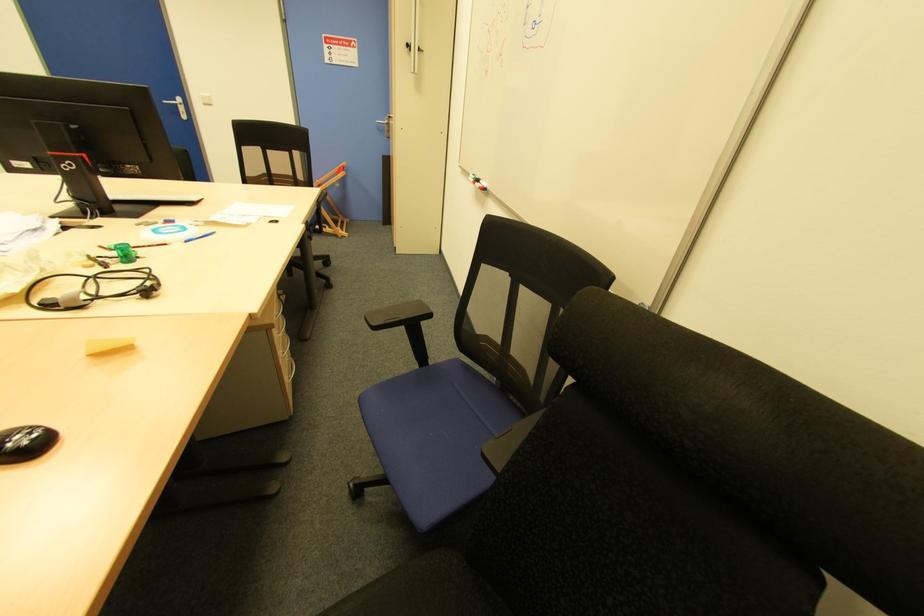
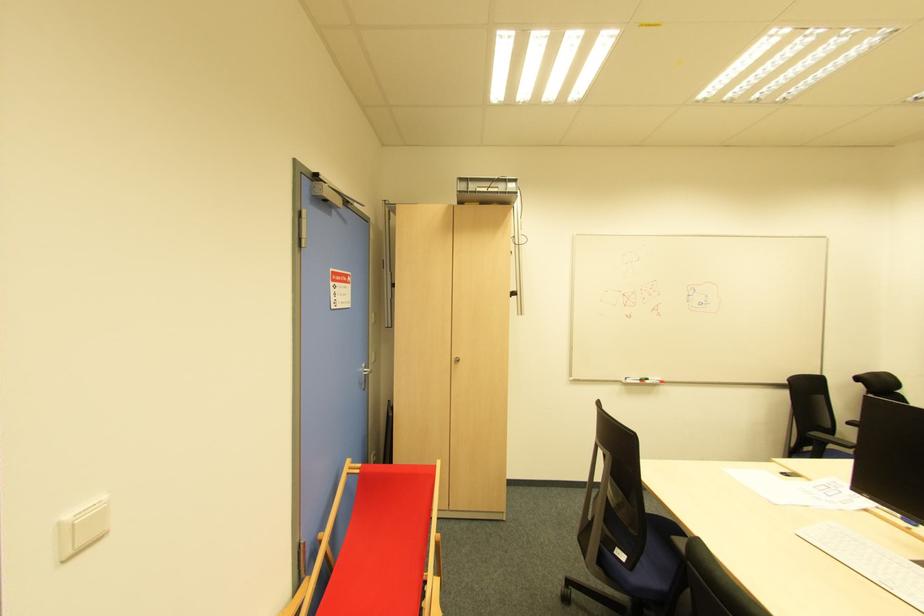
The point at (483,192) is marked in the first image. Where is the corresponding point in the second image?

(662, 383)